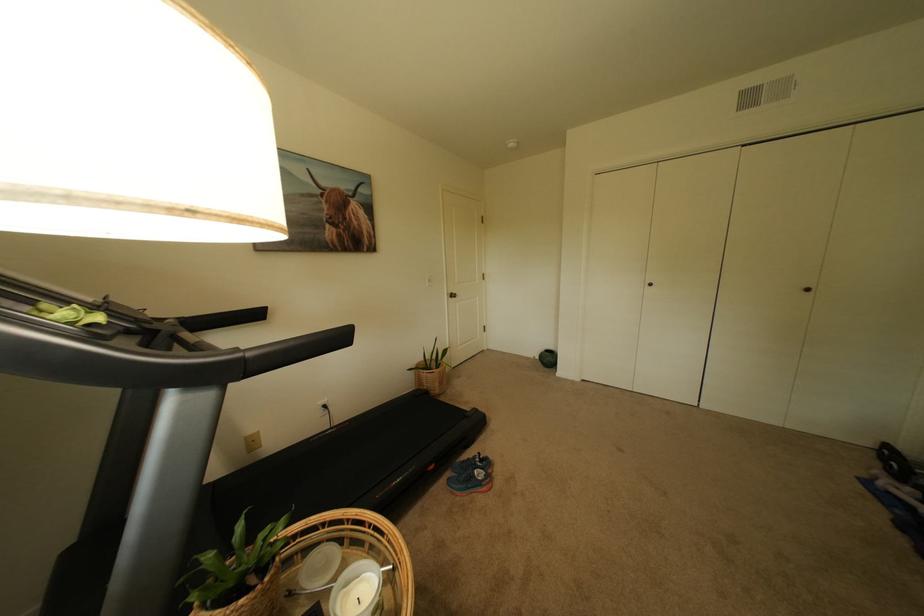
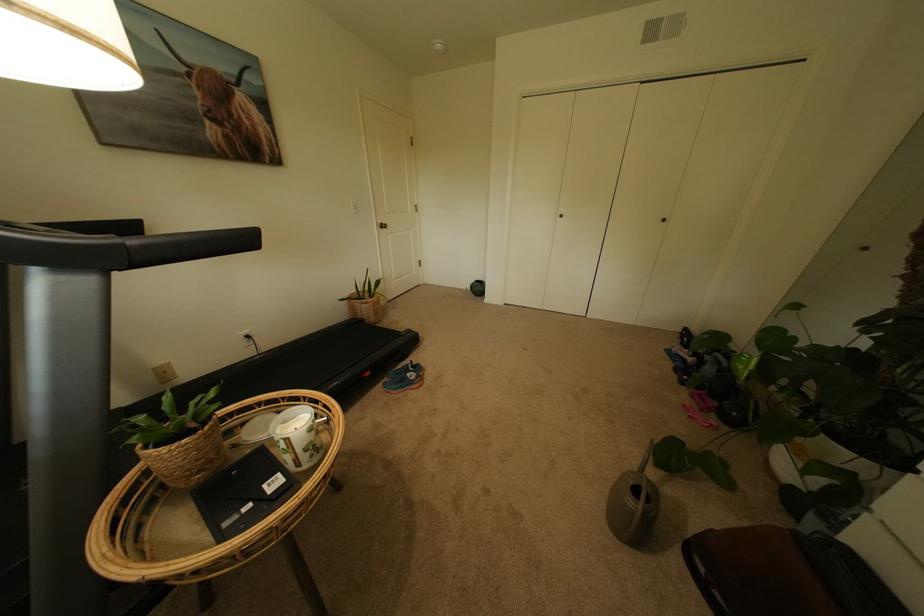
Locate, in the second image, the point that corresponds to the point at 487,464 in the first image.

(419, 370)